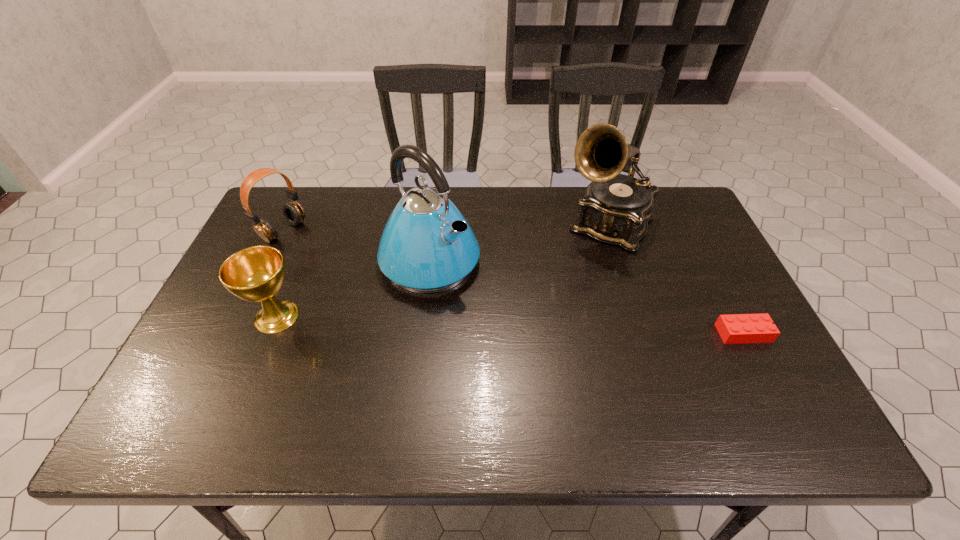
Identify the location of vacant area at the near left corner. (200, 381).

In the image, there is a desktop. Find the location of `free region at the far right corner`. free region at the far right corner is located at coordinates (679, 233).

Locate an element on the screen. The width and height of the screenshot is (960, 540). vacant space at the near right corner of the desktop is located at coordinates (729, 373).

Where is `free space that is in between the shortest object and the headset`? The image size is (960, 540). free space that is in between the shortest object and the headset is located at coordinates tap(514, 282).

Identify the location of unoccupied position between the phonograph record and the rightmost object. The image size is (960, 540). (676, 279).

Where is `vacant space that's between the headset and the shortest object`? This screenshot has width=960, height=540. vacant space that's between the headset and the shortest object is located at coordinates (514, 282).

Where is `free space between the Lego and the chalice`? The image size is (960, 540). free space between the Lego and the chalice is located at coordinates (510, 325).

Find the location of a particular element. The width and height of the screenshot is (960, 540). free space between the kettle and the chalice is located at coordinates (353, 289).

Where is `empty location between the headset and the third object from left to right`? empty location between the headset and the third object from left to right is located at coordinates (357, 246).

Identify the location of vacant space in between the third object from left to right and the Lego. (587, 298).